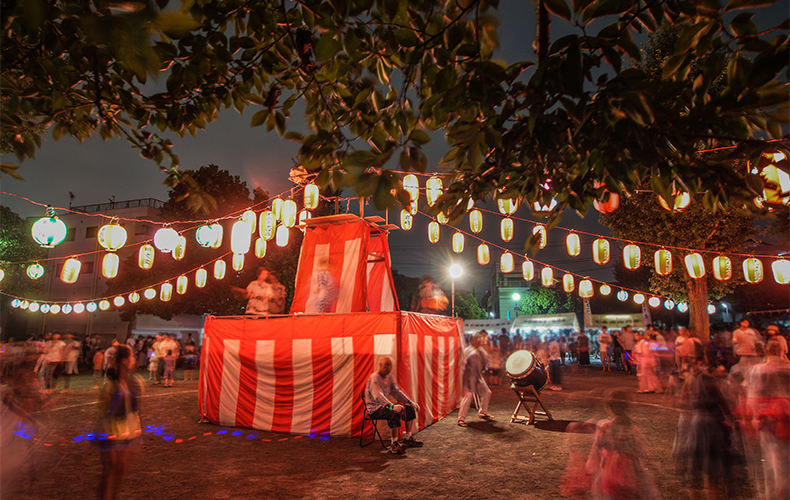
Identify the location of wooden drum stand. This screenshot has height=500, width=790. (531, 405).